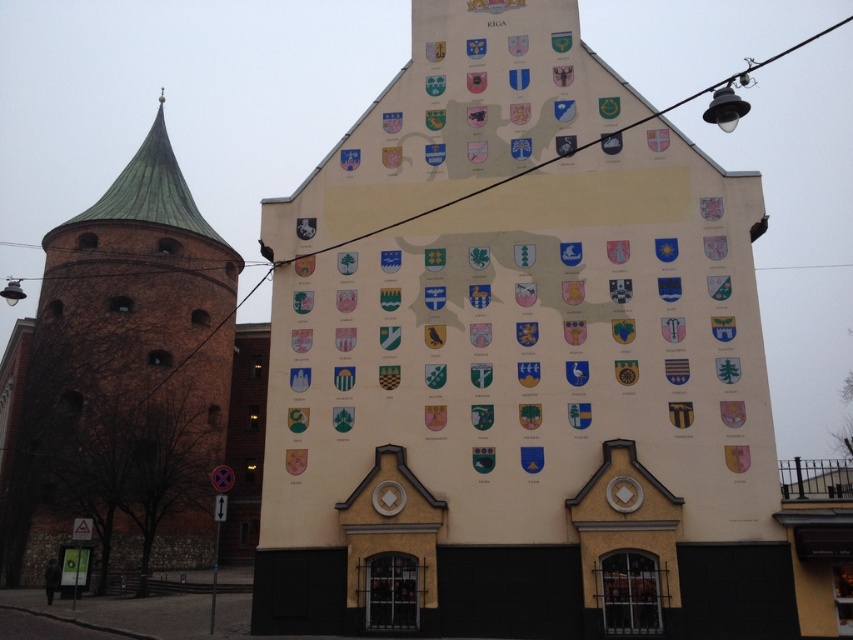
Question: Which point is farther to the camera?

Choices:
 (A) (55, 312)
 (B) (299, 445)

Answer: (A)

Question: Is white painted wall at center smaller than brown brick tower at left?

Choices:
 (A) yes
 (B) no

Answer: (A)

Question: Does white painted wall at center appear on the left side of brown brick tower at left?

Choices:
 (A) no
 (B) yes

Answer: (A)

Question: Which object appears closest to the camera in this image?

Choices:
 (A) white painted wall at center
 (B) brown brick tower at left

Answer: (A)

Question: Which point is farther from the camera taking this photo?

Choices:
 (A) (48, 548)
 (B) (753, 316)

Answer: (A)

Question: Does white painted wall at center have a greater width compared to brown brick tower at left?

Choices:
 (A) yes
 (B) no

Answer: (B)